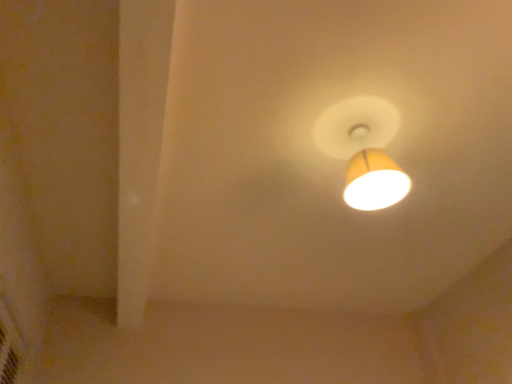
Describe the element at coordinates (364, 150) in the screenshot. The height and width of the screenshot is (384, 512). I see `matte yellow lampshade at upper center` at that location.

The height and width of the screenshot is (384, 512). I want to click on matte yellow lampshade at upper center, so click(x=364, y=150).

At what (x,y) coordinates should I click in order to perform the action: click on matte yellow lampshade at upper center. Please return your answer as a coordinate pair (x, y). Looking at the image, I should click on (364, 150).